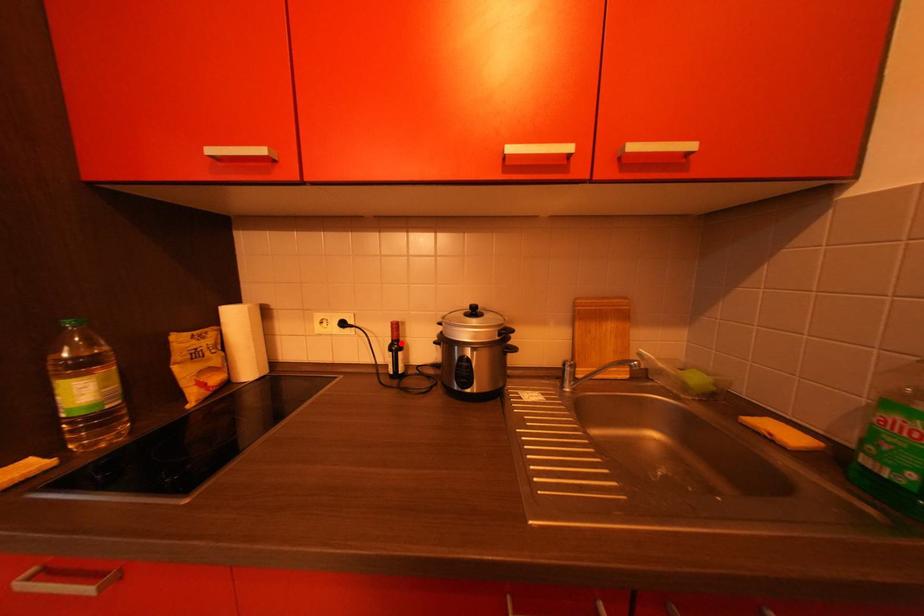
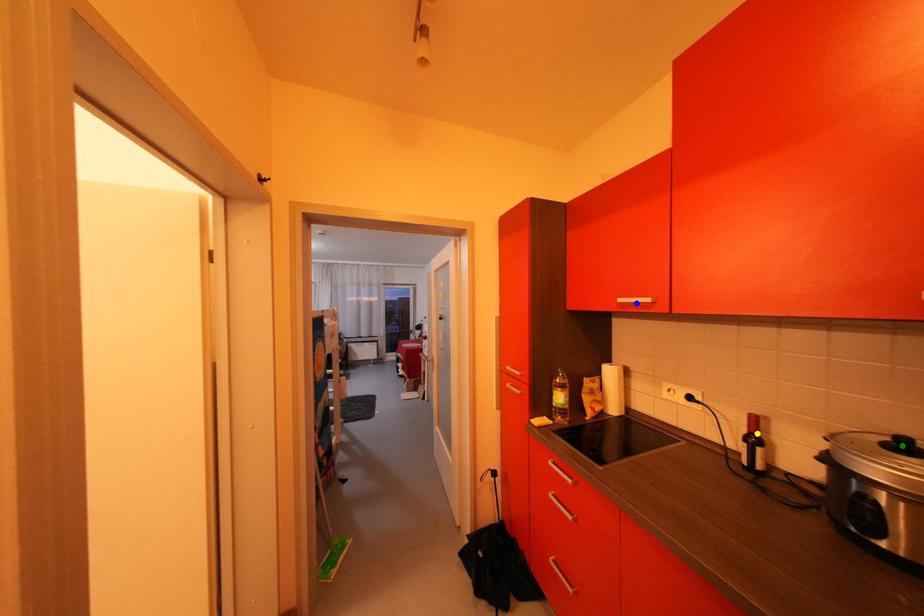
Question: I am providing you with two images of the same scene from different viewpoints. A red point is marked on the first image. You are given multiple points on the second image. In image 2, which mark is for the same physical point as the one in image 1?

Choices:
 (A) green point
 (B) yellow point
 (C) blue point

Answer: (B)